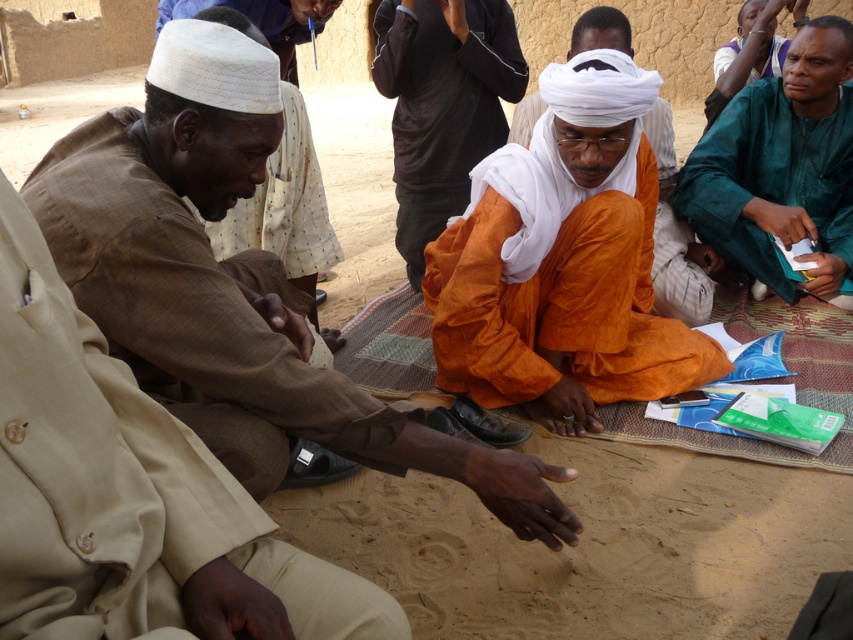
Question: Which object is the closest to the green matte shirt at right?

Choices:
 (A) brown textured cloth at center
 (B) orange cotton robe at center

Answer: (B)

Question: Which of these objects is positioned closest to the brown woven cloth at left?

Choices:
 (A) orange cotton turban at center
 (B) orange cloth at center
 (C) green matte shirt at right
 (D) beige cotton robe at left

Answer: (B)

Question: Does orange cotton robe at center have a smaller size compared to orange cloth at center?

Choices:
 (A) yes
 (B) no

Answer: (B)

Question: Does beige cotton robe at left lie in front of orange cotton robe at center?

Choices:
 (A) yes
 (B) no

Answer: (A)

Question: Among these points, which one is farthest from the camera?

Choices:
 (A) 335,257
 (B) 195,513
 (C) 428,29
 (D) 669,339

Answer: (C)

Question: Observing the image, what is the correct spatial positioning of green matte shirt at right in reference to orange cotton turban at center?

Choices:
 (A) below
 (B) above

Answer: (B)